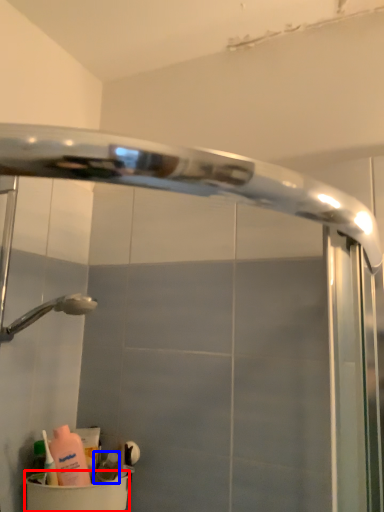
Question: Which point is closer to the camera, toilet bowl (highlighted by a red box) or toiletry (highlighted by a blue box)?

Choices:
 (A) toilet bowl
 (B) toiletry

Answer: (A)